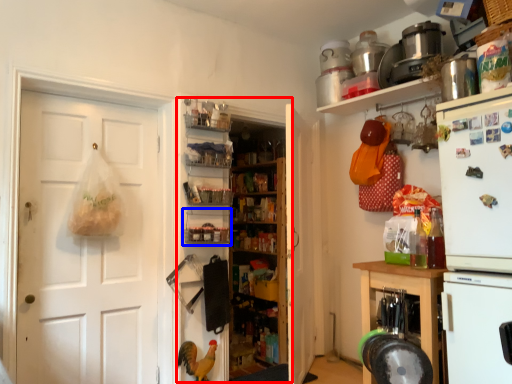
Question: Which object is closer to the camera taking this photo, bookshelf (highlighted by a red box) or shelf (highlighted by a blue box)?

Choices:
 (A) bookshelf
 (B) shelf

Answer: (B)